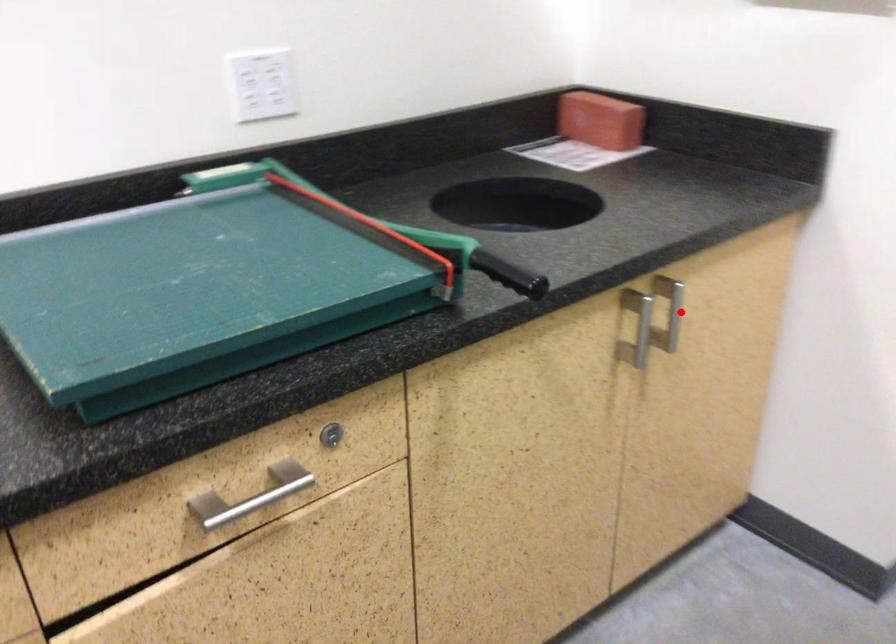
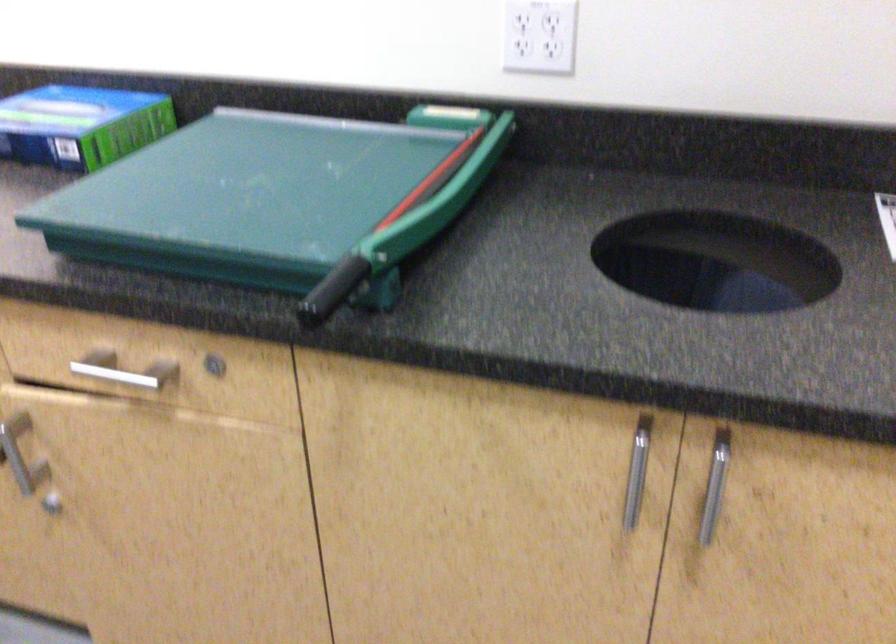
Locate, in the second image, the point that corresponds to the highlighted location in the first image.

(714, 486)